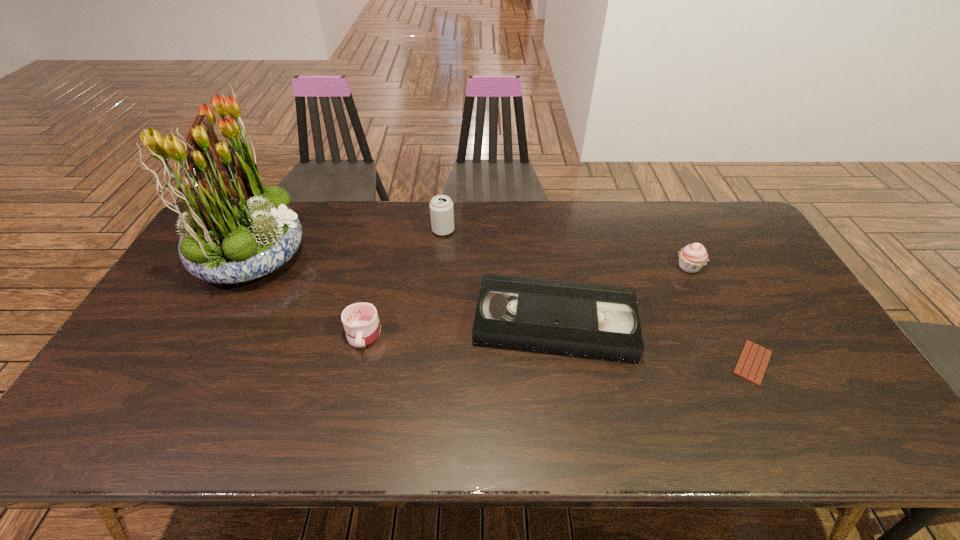
Locate an element on the screen. The height and width of the screenshot is (540, 960). the leftmost object is located at coordinates (236, 230).

What are the coordinates of `the tallest object` in the screenshot? It's located at (236, 230).

The image size is (960, 540). I want to click on the third object from left to right, so click(x=441, y=207).

Locate an element on the screen. This screenshot has width=960, height=540. can is located at coordinates (441, 207).

Where is `cupcake`? The height and width of the screenshot is (540, 960). cupcake is located at coordinates (693, 257).

At what (x,y) coordinates should I click in order to perform the action: click on mug. Please return your answer as a coordinate pair (x, y). The image size is (960, 540). Looking at the image, I should click on (361, 323).

The width and height of the screenshot is (960, 540). I want to click on the fifth object from right to left, so click(x=361, y=323).

The width and height of the screenshot is (960, 540). Identify the location of the fourth object from left to right. (592, 321).

The image size is (960, 540). What are the coordinates of `the fifth tallest object` in the screenshot? It's located at (592, 321).

Find the location of `candy bar`. candy bar is located at coordinates (753, 361).